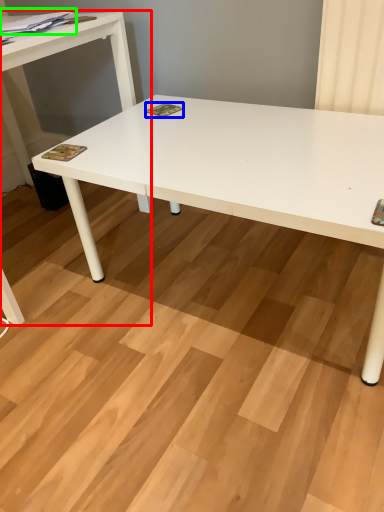
Question: Based on their relative distances, which object is nearer to table (highlighted by a red box)? Choose from magazine (highlighted by a blue box) and magazine (highlighted by a green box).

Choices:
 (A) magazine
 (B) magazine

Answer: (B)